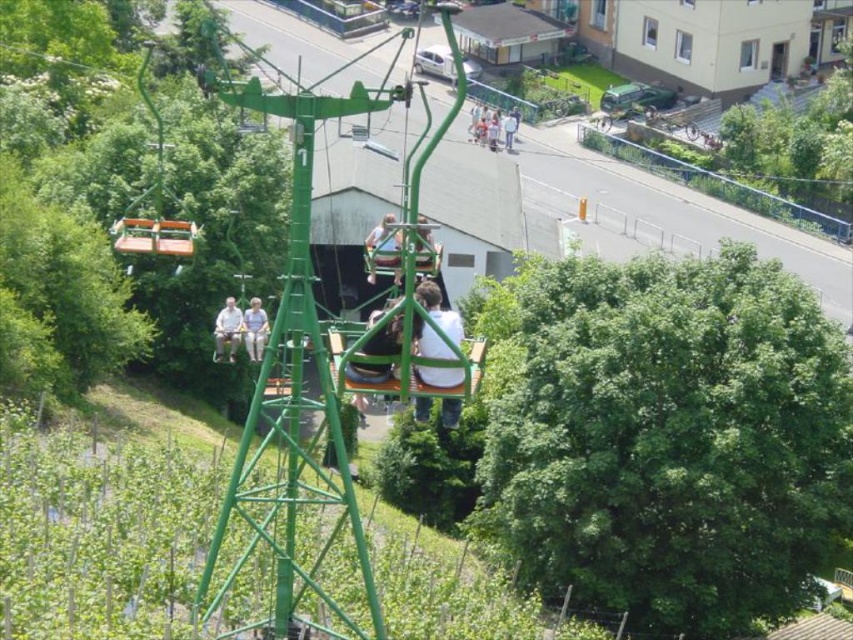
Does light brown leather jacket at lower left lie behind light gray fabric pants at center?

Yes, it is.

Can you confirm if light brown leather jacket at lower left is taller than light gray fabric pants at center?

Correct, light brown leather jacket at lower left is much taller as light gray fabric pants at center.

Is point (222, 337) positioned behind point (256, 330)?

Yes, point (222, 337) is farther from viewer.

Locate an element on the screen. The width and height of the screenshot is (853, 640). light brown leather jacket at lower left is located at coordinates (227, 330).

Is matte green chair at center below light gray fabric pants at center?

Actually, matte green chair at center is above light gray fabric pants at center.

Does matte green chair at center come behind light gray fabric pants at center?

No, it is in front of light gray fabric pants at center.

Where is `matte green chair at center`? This screenshot has height=640, width=853. matte green chair at center is located at coordinates (384, 248).

Is white matte shirt at center taller than green metallic cable car at center?

No.

Who is higher up, white matte shirt at center or green metallic cable car at center?

green metallic cable car at center is above.

At what (x,y) coordinates should I click in order to perform the action: click on white matte shirt at center. Please return your answer as a coordinate pair (x, y). Looking at the image, I should click on (439, 310).